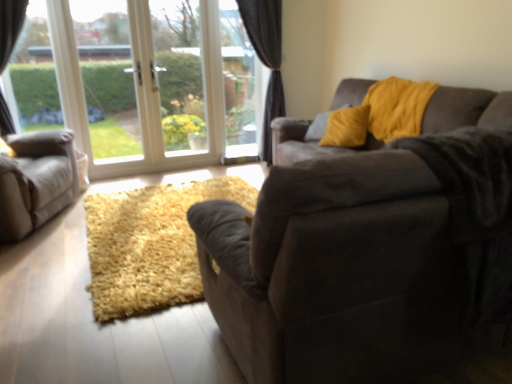
Question: Looking at their shapes, would you say white glass door at center, the 2th window screen from the right, is wider or thinner than transparent glass door at upper left, positioned as the 1th window screen in left-to-right order?

Choices:
 (A) wide
 (B) thin

Answer: (B)

Question: Would you say white glass door at center, acting as the second window screen starting from the left, is to the left or to the right of transparent glass door at upper left, positioned as the 1th window screen in left-to-right order, in the picture?

Choices:
 (A) left
 (B) right

Answer: (B)

Question: Considering the real-world distances, which object is farthest from the white glass window at upper left?

Choices:
 (A) dark gray velvet curtain at center
 (B) suede couch at center, the second studio couch when ordered from left to right
 (C) transparent glass window screen at center, the 3th window screen positioned from the left
 (D) yellow fabric pillow at upper center
 (E) yellow velvet pillow at upper right

Answer: (B)

Question: Which object is positioned closest to the suede couch at center, which is the 1th studio couch in right-to-left order?

Choices:
 (A) transparent glass door at upper left, the 3th window screen from the right
 (B) transparent glass window screen at center, the first window screen when ordered from right to left
 (C) yellow velvet pillow at upper right
 (D) white glass door at center, acting as the second window screen starting from the left
 (E) matte gray armchair at left, arranged as the 2th studio couch when viewed from the right

Answer: (C)